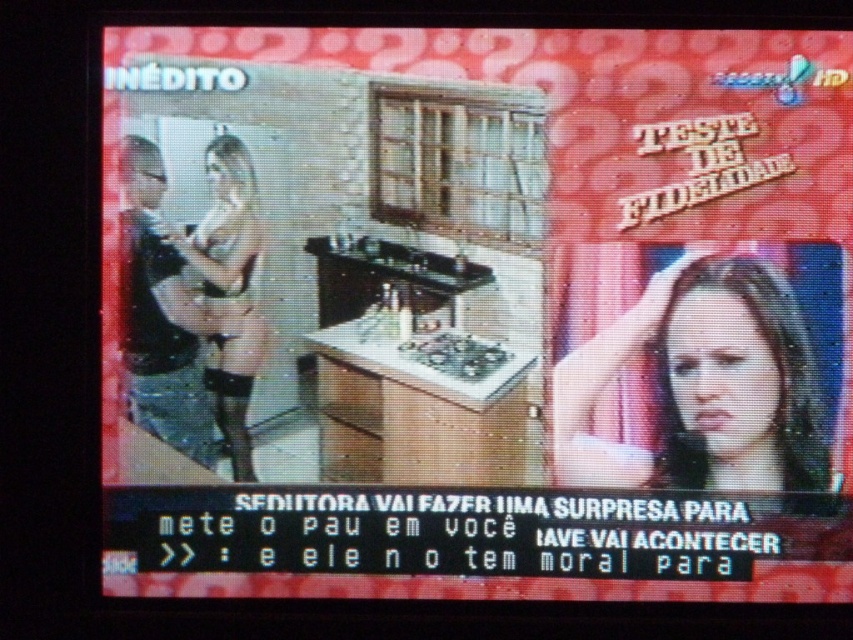
You are a camera operator trying to focus on the smooth brown hair at right in the scene. What are the coordinates where you should adjust the camera to capture it?

The smooth brown hair at right is located at coordinates point [703,385], so adjust the camera to that position to capture it.